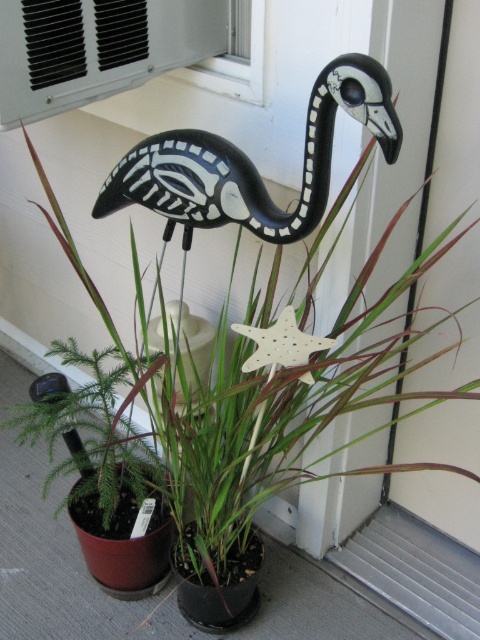
Does black matte plastic bird at upper center have a greater height compared to white matte star at center?

Yes.

Between point (304, 189) and point (257, 337), which one is positioned behind?

The point (257, 337) is behind.

The height and width of the screenshot is (640, 480). What are the coordinates of `black matte plastic bird at upper center` in the screenshot? It's located at (252, 163).

Which is more to the left, white plastic air conditioner at upper center or white matte star at center?

From the viewer's perspective, white plastic air conditioner at upper center appears more on the left side.

This screenshot has width=480, height=640. Find the location of `white plastic air conditioner at upper center`. white plastic air conditioner at upper center is located at coordinates (96, 49).

This screenshot has height=640, width=480. Identify the location of white plastic air conditioner at upper center. (96, 49).

Is point (155, 179) positioned after point (25, 10)?

Yes, it is behind point (25, 10).

Which is behind, point (357, 116) or point (4, 1)?

Point (4, 1)

Locate an element on the screen. black matte plastic bird at upper center is located at coordinates (252, 163).